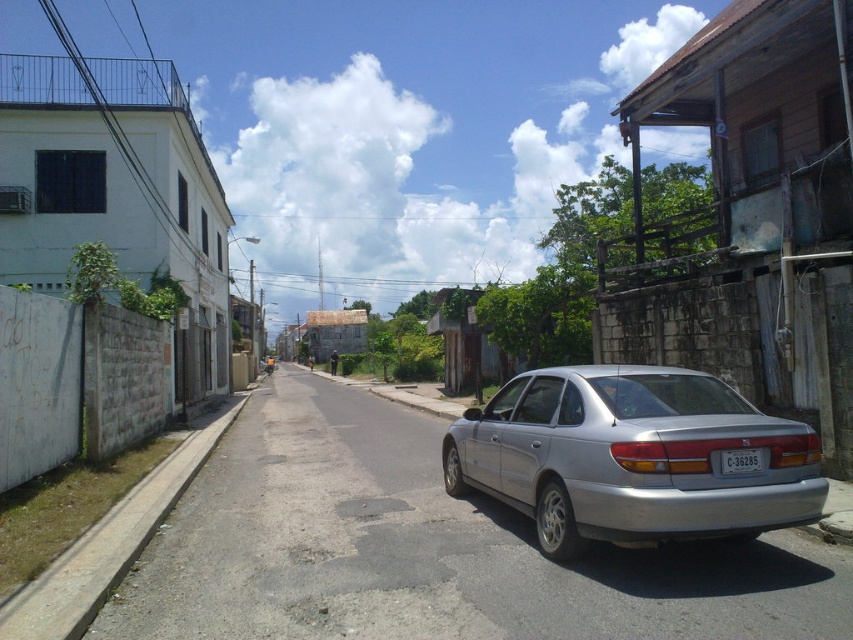
Is silver metallic car at center further to camera compared to white plastic license plate at rear?

No, silver metallic car at center is in front of white plastic license plate at rear.

What do you see at coordinates (425, 548) in the screenshot? The height and width of the screenshot is (640, 853). I see `silver metallic car at center` at bounding box center [425, 548].

Find the location of a particular element. silver metallic car at center is located at coordinates (425, 548).

Identify the location of silver metallic car at center. (425, 548).

Who is shorter, silver metallic car at right or white plastic license plate at rear?

white plastic license plate at rear is shorter.

Between point (607, 474) and point (755, 460), which one is positioned behind?

The point (755, 460) is behind.

Find the location of a particular element. silver metallic car at right is located at coordinates (631, 458).

Can you confirm if silver metallic car at center is thinner than silver metallic car at right?

No, silver metallic car at center is not thinner than silver metallic car at right.

Which is in front, point (469, 524) or point (712, 376)?

Point (469, 524) is more forward.

At what (x,y) coordinates should I click in order to perform the action: click on silver metallic car at center. Please return your answer as a coordinate pair (x, y). This screenshot has width=853, height=640. Looking at the image, I should click on (425, 548).